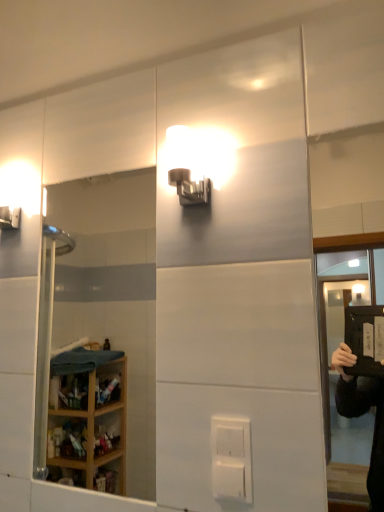
Locate an element on the screen. The width and height of the screenshot is (384, 512). white plastic electric outlet at center is located at coordinates (231, 458).

The image size is (384, 512). What do you see at coordinates (196, 163) in the screenshot?
I see `matte white sconce at upper center` at bounding box center [196, 163].

Where is `matte white sconce at upper center`? matte white sconce at upper center is located at coordinates (196, 163).

The height and width of the screenshot is (512, 384). What do you see at coordinates (342, 380) in the screenshot? I see `transparent plastic screen door at upper right` at bounding box center [342, 380].

Image resolution: width=384 pixels, height=512 pixels. Find the location of `clear glass mirror at left`. clear glass mirror at left is located at coordinates (113, 293).

From a real-world perspective, is clear glass mirror at left positioned above or below transparent plastic screen door at upper right?

From a real-world perspective, clear glass mirror at left is physically below transparent plastic screen door at upper right.

Considering the sizes of clear glass mirror at left and transparent plastic screen door at upper right in the image, is clear glass mirror at left bigger or smaller than transparent plastic screen door at upper right?

In the image, clear glass mirror at left appears to be larger than transparent plastic screen door at upper right.

Considering the sizes of clear glass mirror at left and transparent plastic screen door at upper right in the image, is clear glass mirror at left wider or thinner than transparent plastic screen door at upper right?

Considering their sizes, clear glass mirror at left looks slimmer than transparent plastic screen door at upper right.

Is point (238, 425) less distant than point (102, 336)?

Yes, it is.

Which object is positioned more to the left, white plastic electric outlet at center or clear glass mirror at left?

Positioned to the left is clear glass mirror at left.

The height and width of the screenshot is (512, 384). I want to click on electric outlet lying below the clear glass mirror at left (from the image's perspective), so click(x=231, y=458).

From the image's perspective, which object appears higher, white plastic electric outlet at center or clear glass mirror at left?

clear glass mirror at left, from the image's perspective.

From a real-world perspective, is matte white sconce at upper center beneath white plastic electric outlet at center?

No, from a real-world perspective, matte white sconce at upper center is not under white plastic electric outlet at center.

In the image, is matte white sconce at upper center positioned in front of or behind white plastic electric outlet at center?

matte white sconce at upper center is positioned farther from the viewer than white plastic electric outlet at center.

Considering the sizes of objects matte white sconce at upper center and white plastic electric outlet at center in the image provided, who is bigger, matte white sconce at upper center or white plastic electric outlet at center?

With larger size is matte white sconce at upper center.

In the scene shown: Which is farther, (183, 147) or (234, 429)?

The point (183, 147) is farther from the camera.

Identify the location of mirror behind the matte white sconce at upper center. This screenshot has height=512, width=384. (113, 293).

Is clear glass mirror at left next to matte white sconce at upper center and touching it?

clear glass mirror at left and matte white sconce at upper center are not in contact.

Which object is more forward, clear glass mirror at left or matte white sconce at upper center?

matte white sconce at upper center is closer to the camera.

Considering the sizes of matte white sconce at upper center and clear glass mirror at left in the image, is matte white sconce at upper center taller or shorter than clear glass mirror at left?

Considering their sizes, matte white sconce at upper center has less height than clear glass mirror at left.

Does point (213, 160) come in front of point (153, 429)?

Yes.

Which of these two, matte white sconce at upper center or clear glass mirror at left, is smaller?

matte white sconce at upper center.

From the image's perspective, is matte white sconce at upper center located above clear glass mirror at left?

Correct, matte white sconce at upper center appears higher than clear glass mirror at left in the image.

Is clear glass mirror at left positioned before white plastic electric outlet at center?

No, it is not.

Can you confirm if clear glass mirror at left is thinner than white plastic electric outlet at center?

Indeed, clear glass mirror at left has a lesser width compared to white plastic electric outlet at center.

From the picture: Measure the distance from matte white sconce at upper center to transparent plastic screen door at upper right.

matte white sconce at upper center and transparent plastic screen door at upper right are 7.83 feet apart.

How many degrees apart are the facing directions of matte white sconce at upper center and transparent plastic screen door at upper right?

There is a 1.56-degree angle between the facing directions of matte white sconce at upper center and transparent plastic screen door at upper right.

Based on the photo, considering the sizes of objects matte white sconce at upper center and transparent plastic screen door at upper right in the image provided, who is thinner, matte white sconce at upper center or transparent plastic screen door at upper right?

transparent plastic screen door at upper right.

Is matte white sconce at upper center far away from transparent plastic screen door at upper right?

Yes.

I want to click on screen door to the right of clear glass mirror at left, so click(342, 380).

What are the coordinates of `electric outlet below the clear glass mirror at left (from a real-world perspective)` in the screenshot? It's located at point(231,458).

From the picture: From the image, which object appears to be nearer to white plastic electric outlet at center, clear glass mirror at left or matte white sconce at upper center?

Based on the image, matte white sconce at upper center appears to be nearer to white plastic electric outlet at center.

Which object lies further to the anchor point clear glass mirror at left, white plastic electric outlet at center or transparent plastic screen door at upper right?

white plastic electric outlet at center lies further to clear glass mirror at left than the other object.

Estimate the real-world distances between objects in this image. Which object is closer to white plastic electric outlet at center, clear glass mirror at left or transparent plastic screen door at upper right?

clear glass mirror at left is closer to white plastic electric outlet at center.

Based on their spatial positions, is matte white sconce at upper center or transparent plastic screen door at upper right further from white plastic electric outlet at center?

transparent plastic screen door at upper right is further to white plastic electric outlet at center.

Considering their positions, is white plastic electric outlet at center positioned further to transparent plastic screen door at upper right than matte white sconce at upper center?

Based on the image, white plastic electric outlet at center appears to be further to transparent plastic screen door at upper right.

Estimate the real-world distances between objects in this image. Which object is further from matte white sconce at upper center, white plastic electric outlet at center or transparent plastic screen door at upper right?

transparent plastic screen door at upper right lies further to matte white sconce at upper center than the other object.

Considering their positions, is clear glass mirror at left positioned closer to matte white sconce at upper center than white plastic electric outlet at center?

white plastic electric outlet at center lies closer to matte white sconce at upper center than the other object.

Considering their positions, is matte white sconce at upper center positioned closer to clear glass mirror at left than transparent plastic screen door at upper right?

Among the two, transparent plastic screen door at upper right is located nearer to clear glass mirror at left.

This screenshot has height=512, width=384. In order to click on electric outlet situated between clear glass mirror at left and transparent plastic screen door at upper right from left to right in this screenshot , I will do `click(231, 458)`.

Identify the location of mirror between matte white sconce at upper center and white plastic electric outlet at center from top to bottom. This screenshot has width=384, height=512. (113, 293).

The height and width of the screenshot is (512, 384). Identify the location of light fixture between clear glass mirror at left and transparent plastic screen door at upper right from left to right. (196, 163).

At what (x,y) coordinates should I click in order to perform the action: click on screen door between matte white sconce at upper center and white plastic electric outlet at center in the up-down direction. Please return your answer as a coordinate pair (x, y). The image size is (384, 512). Looking at the image, I should click on (342, 380).